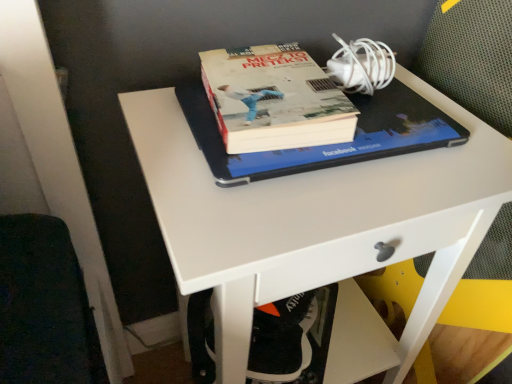
Where is `space that is in front of hardcover book at center`? space that is in front of hardcover book at center is located at coordinates (270, 210).